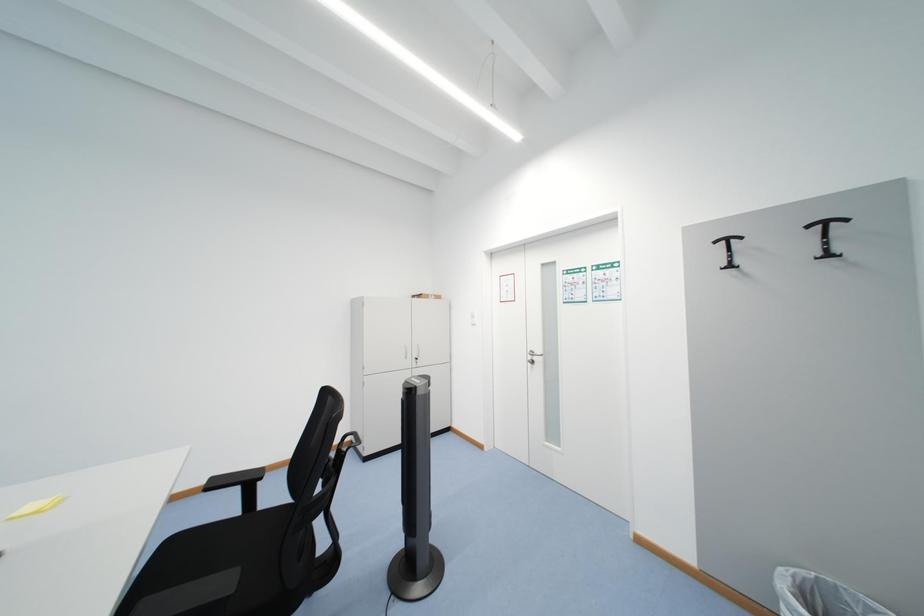
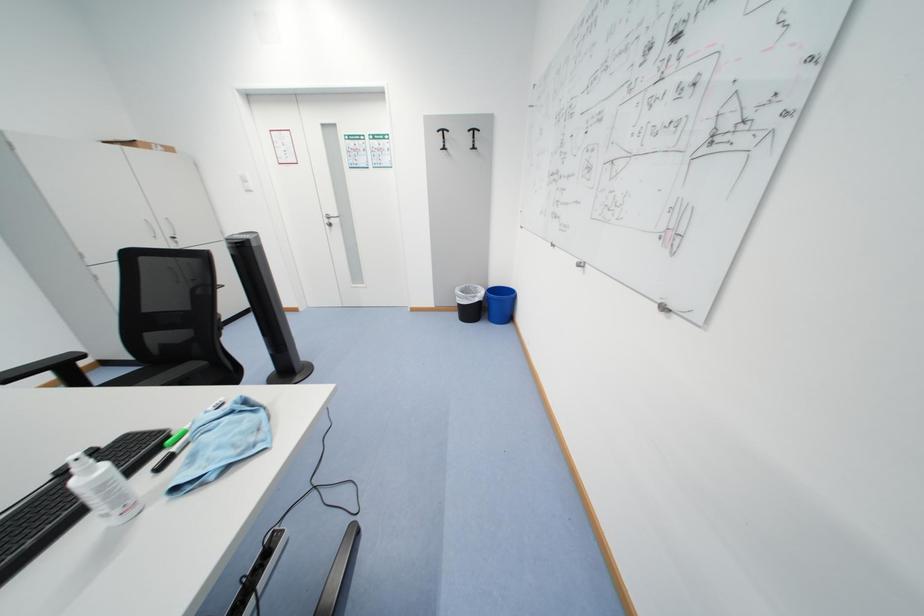
First-person continuous shooting, in which direction is the camera rotating?

The camera rotated toward right-down.